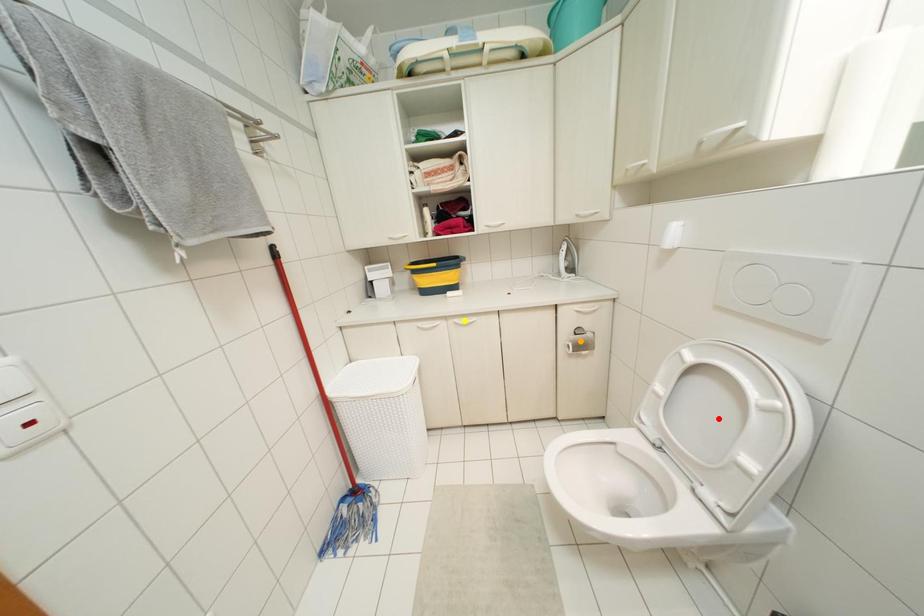
Order these from nearest to farthest:
red point | yellow point | orange point

orange point
yellow point
red point